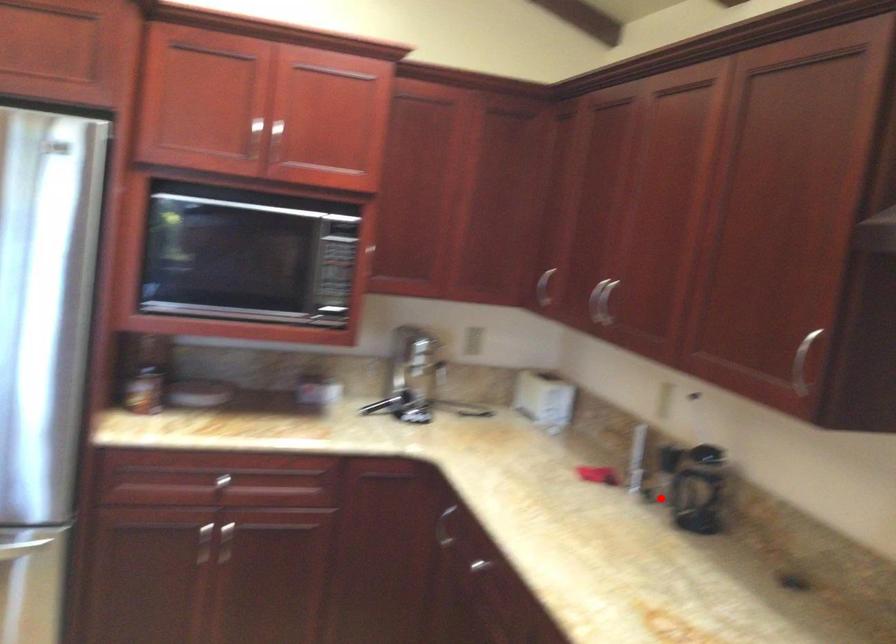
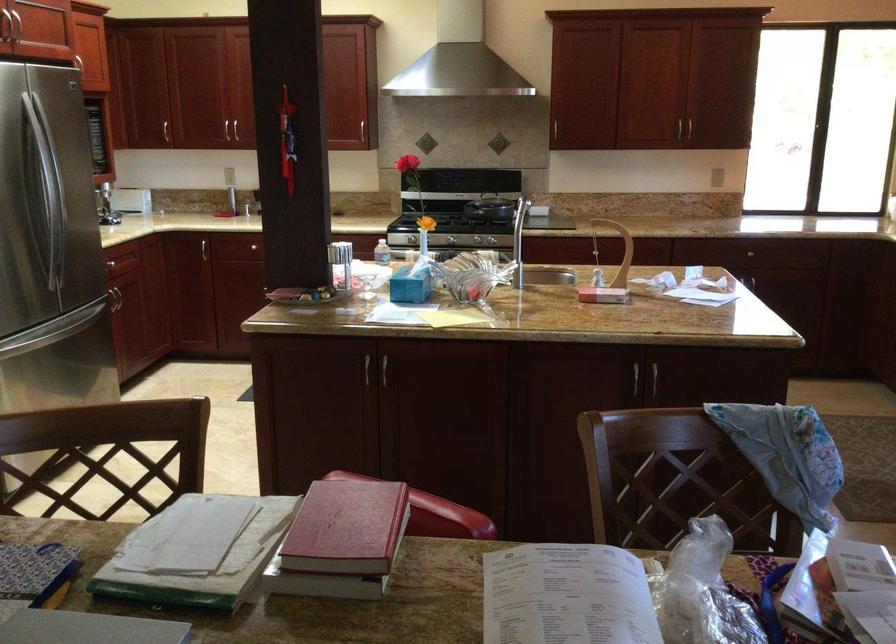
Where in the second image is the point corresponding to the highlighted location from the first image?

(202, 205)